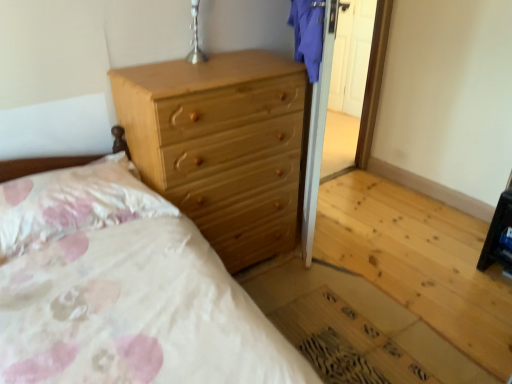
Question: Considering the relative positions of silver metallic table lamp at upper center and natural wood chest of drawers at upper center in the image provided, is silver metallic table lamp at upper center to the left of natural wood chest of drawers at upper center from the viewer's perspective?

Choices:
 (A) yes
 (B) no

Answer: (A)

Question: Does silver metallic table lamp at upper center have a lesser height compared to natural wood chest of drawers at upper center?

Choices:
 (A) yes
 (B) no

Answer: (A)

Question: Considering the relative positions of silver metallic table lamp at upper center and natural wood chest of drawers at upper center in the image provided, is silver metallic table lamp at upper center behind natural wood chest of drawers at upper center?

Choices:
 (A) no
 (B) yes

Answer: (B)

Question: From a real-world perspective, is silver metallic table lamp at upper center on top of natural wood chest of drawers at upper center?

Choices:
 (A) no
 (B) yes

Answer: (B)

Question: From the image's perspective, is silver metallic table lamp at upper center beneath natural wood chest of drawers at upper center?

Choices:
 (A) yes
 (B) no

Answer: (B)

Question: Is silver metallic table lamp at upper center positioned beyond the bounds of natural wood chest of drawers at upper center?

Choices:
 (A) yes
 (B) no

Answer: (A)

Question: Can you confirm if natural wood chest of drawers at upper center is shorter than silver metallic table lamp at upper center?

Choices:
 (A) yes
 (B) no

Answer: (B)

Question: Is natural wood chest of drawers at upper center at the right side of silver metallic table lamp at upper center?

Choices:
 (A) no
 (B) yes

Answer: (B)

Question: From a real-world perspective, is natural wood chest of drawers at upper center under silver metallic table lamp at upper center?

Choices:
 (A) no
 (B) yes

Answer: (B)

Question: Does natural wood chest of drawers at upper center have a greater height compared to silver metallic table lamp at upper center?

Choices:
 (A) yes
 (B) no

Answer: (A)

Question: Is silver metallic table lamp at upper center at the back of natural wood chest of drawers at upper center?

Choices:
 (A) no
 (B) yes

Answer: (A)

Question: Considering the relative positions of natural wood chest of drawers at upper center and silver metallic table lamp at upper center in the image provided, is natural wood chest of drawers at upper center to the left of silver metallic table lamp at upper center from the viewer's perspective?

Choices:
 (A) yes
 (B) no

Answer: (B)

Question: Does fluffy white pillow at upper left have a greater height compared to natural wood chest of drawers at upper center?

Choices:
 (A) no
 (B) yes

Answer: (A)